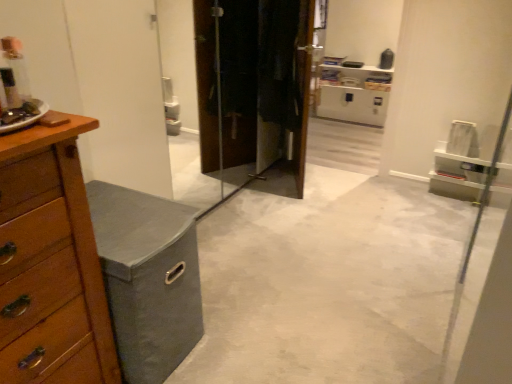
Question: From the image's perspective, is gray fabric storage bin at left positioned above or below wooden vanity at left?

Choices:
 (A) below
 (B) above

Answer: (B)

Question: Is gray fabric storage bin at left inside the boundaries of wooden vanity at left, or outside?

Choices:
 (A) inside
 (B) outside

Answer: (B)

Question: Estimate the real-world distances between objects in this image. Which object is closer to the wooden chest of drawers at left?

Choices:
 (A) gray fabric storage bin at left
 (B) wooden vanity at left

Answer: (B)

Question: Which object is the closest to the wooden vanity at left?

Choices:
 (A) wooden chest of drawers at left
 (B) gray fabric storage bin at left

Answer: (A)